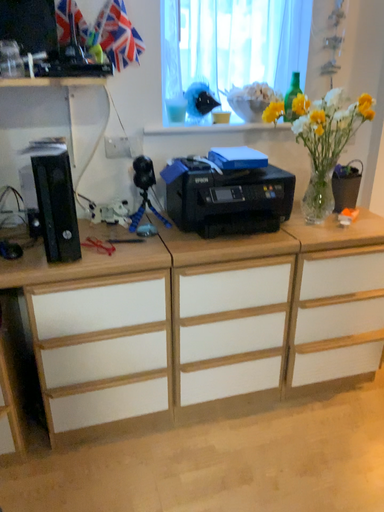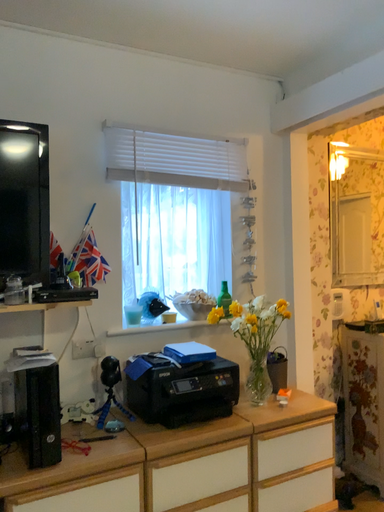
Question: Which way did the camera rotate in the video?

Choices:
 (A) rotated right
 (B) rotated left

Answer: (A)